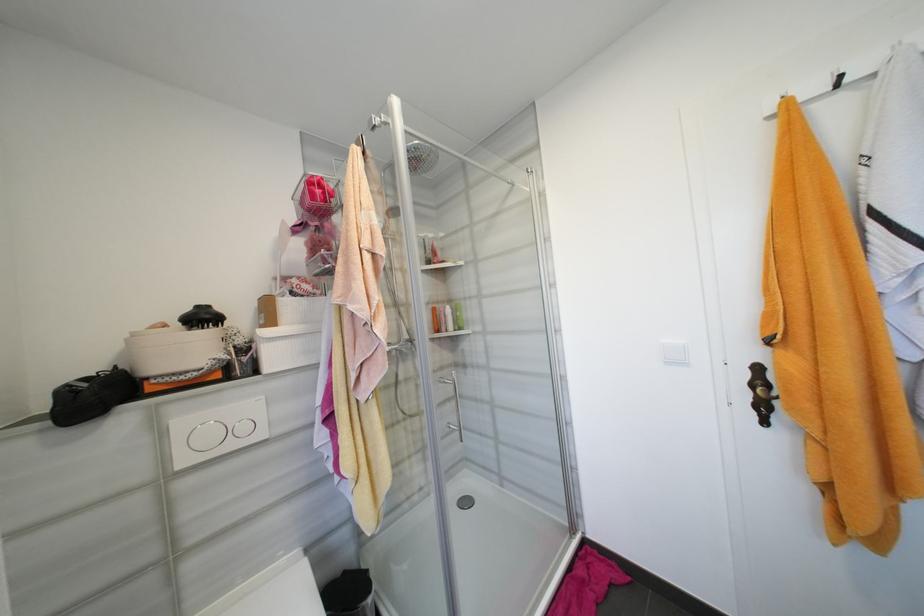
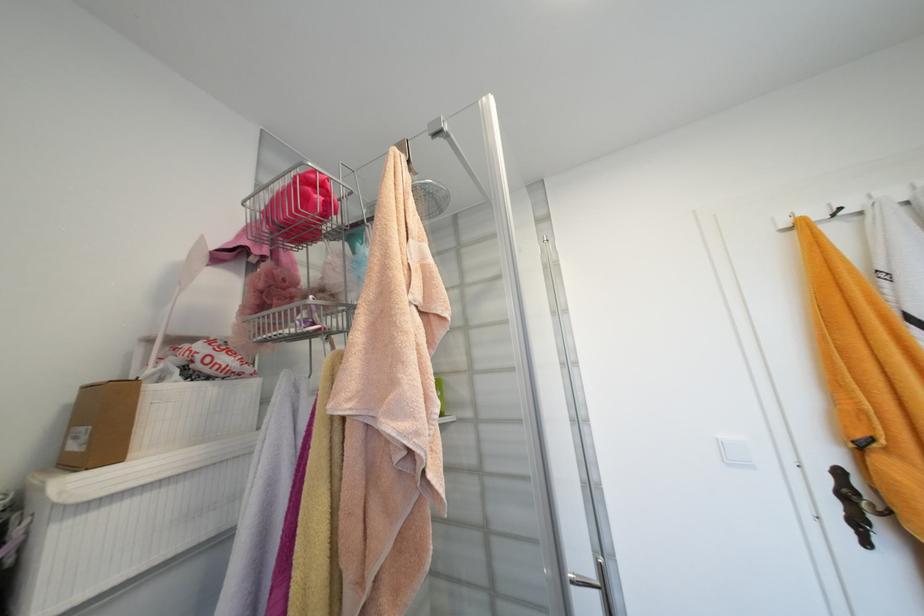
Find the pixel in the second image that matches (325,243) in the first image.

(289, 282)